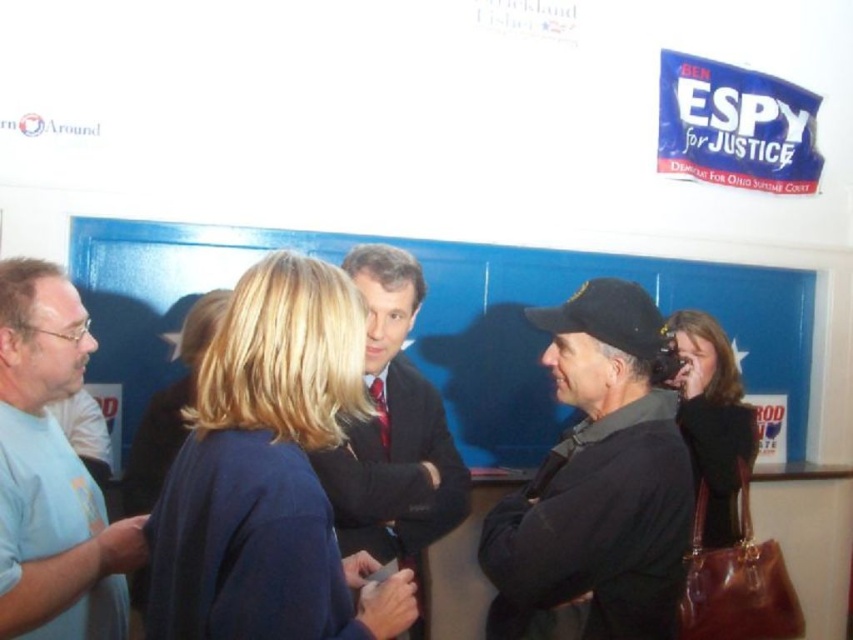
Question: Is dark blue fabric jacket at center above light blue t-shirt at left?

Choices:
 (A) yes
 (B) no

Answer: (A)

Question: Considering the real-world distances, which object is closest to the dark brown leather purse at lower right?

Choices:
 (A) blonde hair at center
 (B) dark gray fabric jacket at center
 (C) light blue t-shirt at left
 (D) dark blue fabric jacket at center

Answer: (B)

Question: Does dark suit at center have a greater width compared to blonde hair at center?

Choices:
 (A) yes
 (B) no

Answer: (B)

Question: Among these objects, which one is farthest from the camera?

Choices:
 (A) dark suit at center
 (B) dark blue fabric jacket at center
 (C) light blue t-shirt at left
 (D) dark brown leather purse at lower right

Answer: (D)

Question: Can you confirm if dark gray fabric jacket at center is smaller than light blue t-shirt at left?

Choices:
 (A) yes
 (B) no

Answer: (B)

Question: Which is nearer to the dark blue fabric jacket at center?

Choices:
 (A) blonde hair at center
 (B) light blue t-shirt at left

Answer: (B)